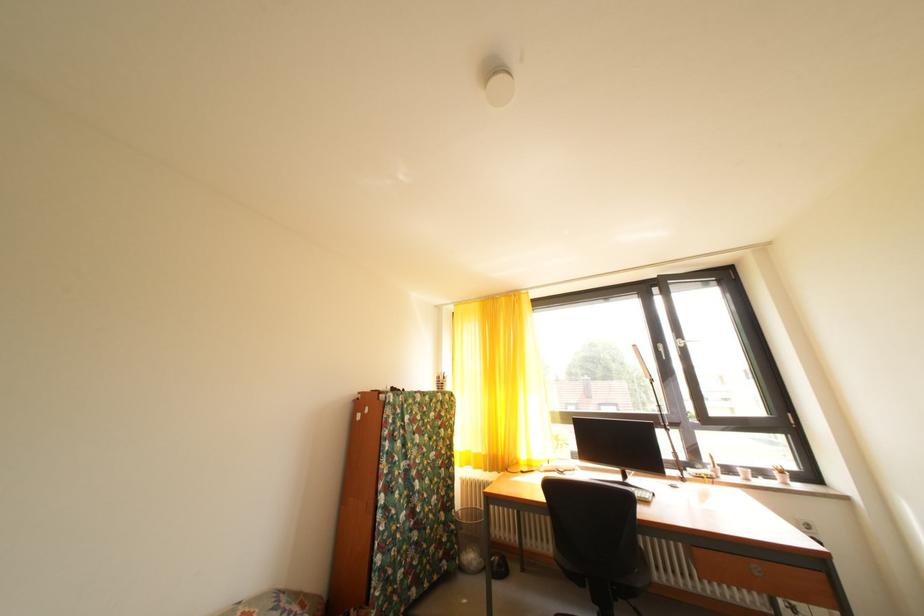
Image resolution: width=924 pixels, height=616 pixels. Describe the element at coordinates (756, 570) in the screenshot. I see `a drawer handle` at that location.